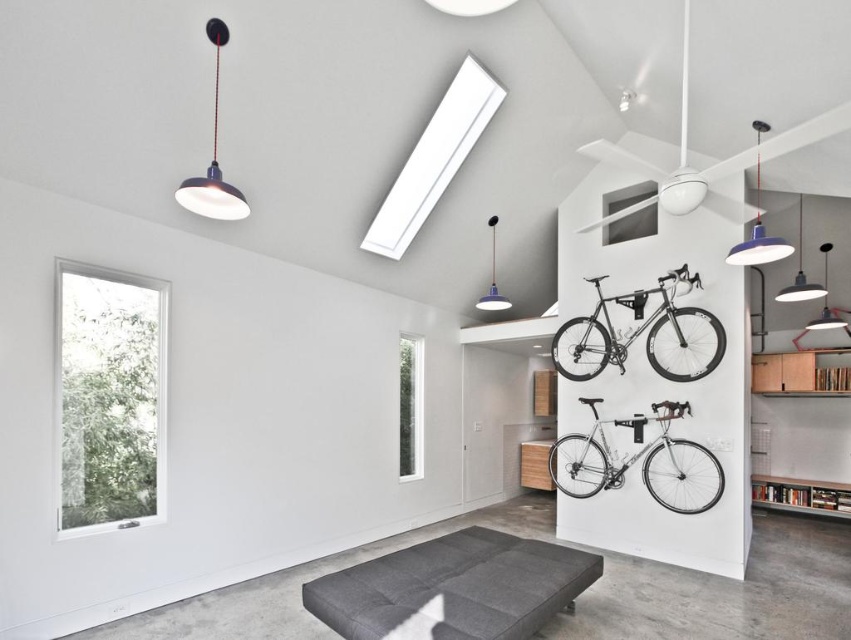
You are standing in the garage and see two points marked on the wall. The first point is at coordinate point (467, 579) and the second is at point (638, 332). Which point is closer to you?

Point (467, 579) is in front of point (638, 332), so it is closer to you.

You are organizing a small gathering in the garage and need to place a 1.5 meter long table between the dark gray fabric bench at lower center and the silver metallic bicycle at lower right. Is there enough space between them to fit the table?

The dark gray fabric bench at lower center is to the left of the silver metallic bicycle at lower right, but the exact distance between them isn t specified. Without knowing the distance, it s impossible to determine if the table will fit.